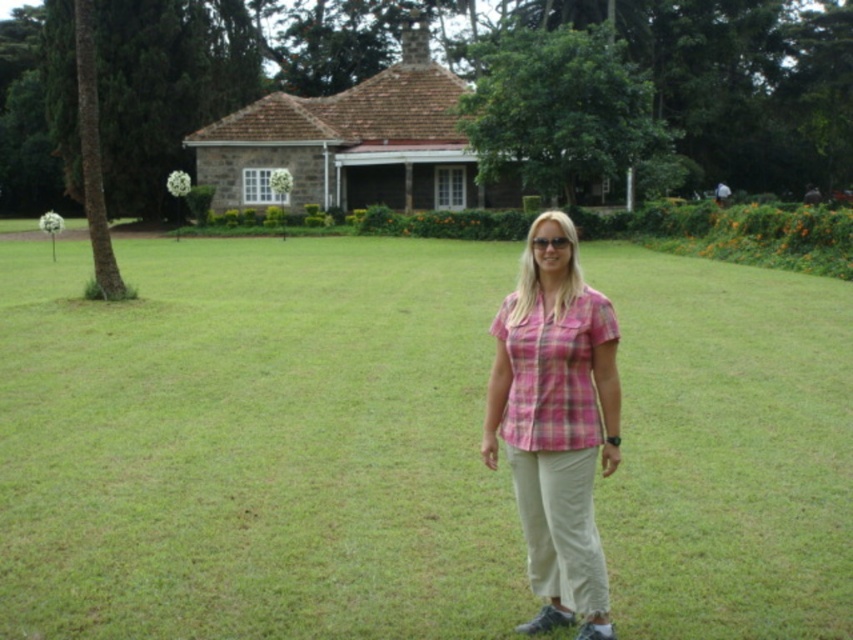
Question: Considering the relative positions of green grass at center and pink plaid shirt at center in the image provided, where is green grass at center located with respect to pink plaid shirt at center?

Choices:
 (A) above
 (B) below

Answer: (A)

Question: Can you confirm if green grass at center is thinner than pink plaid shirt at center?

Choices:
 (A) no
 (B) yes

Answer: (A)

Question: Is green grass at center thinner than pink plaid shirt at center?

Choices:
 (A) yes
 (B) no

Answer: (B)

Question: Which of the following is the farthest from the observer?

Choices:
 (A) (219, 612)
 (B) (526, 400)

Answer: (A)

Question: Which of the following is the closest to the observer?

Choices:
 (A) (544, 317)
 (B) (645, 339)

Answer: (A)